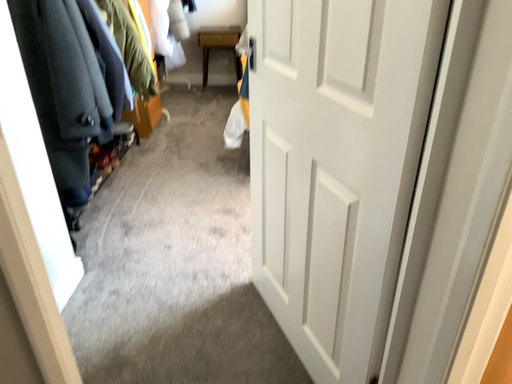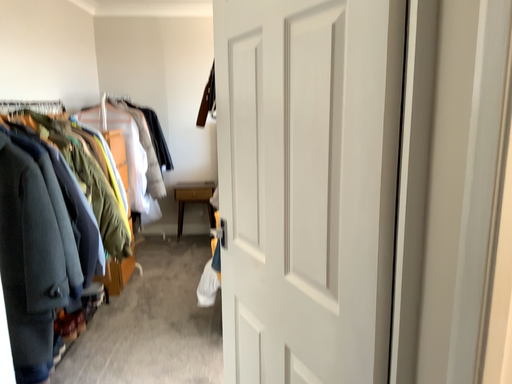
Question: Which way did the camera rotate in the video?

Choices:
 (A) rotated downward
 (B) rotated upward

Answer: (B)